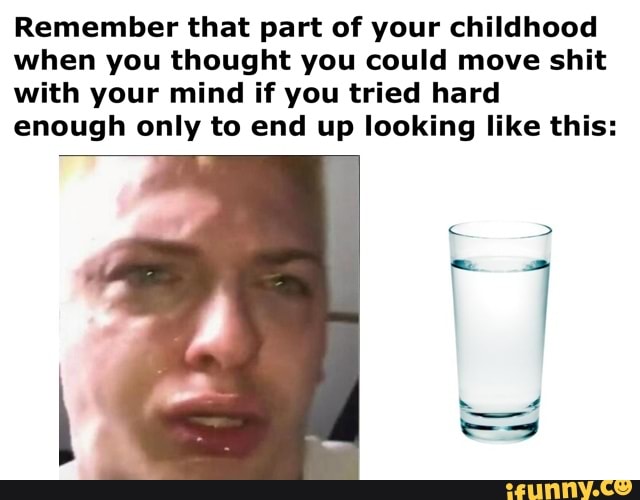
The height and width of the screenshot is (500, 640). Identify the location of wall. (345, 251).